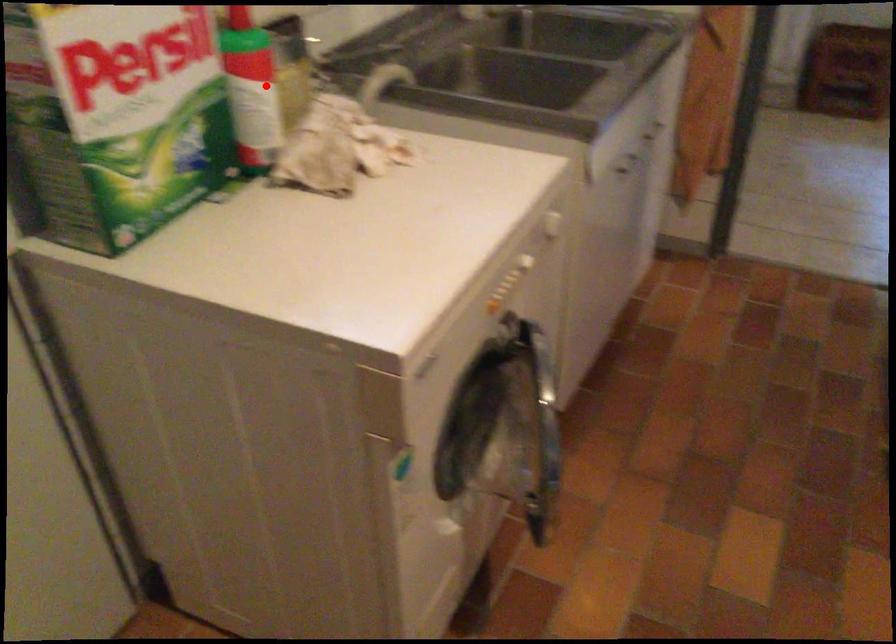
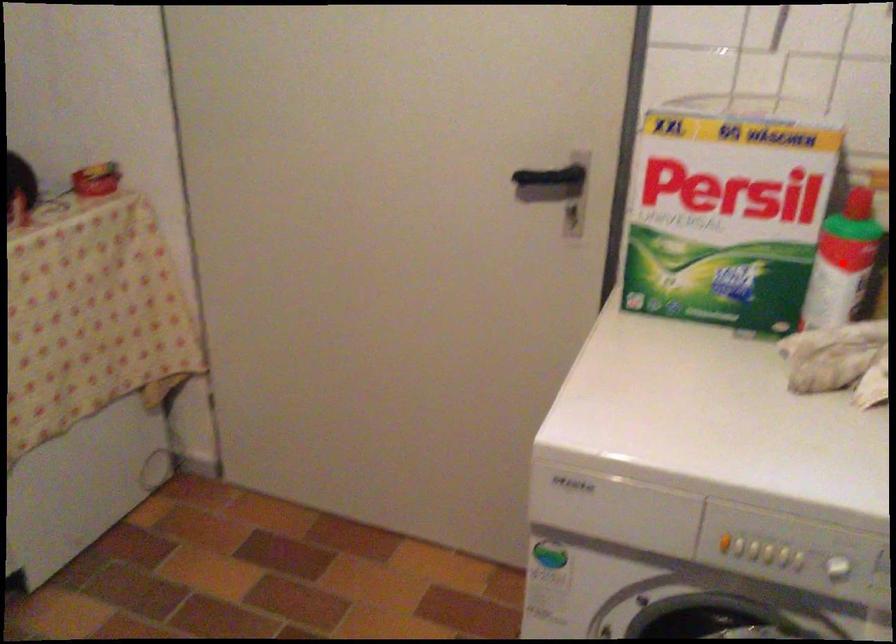
I am providing you with two images of the same scene from different viewpoints. A red point is marked on the first image and another point is marked on the second image. Are the points marked in image1 and image2 representing the same 3D position?

Yes